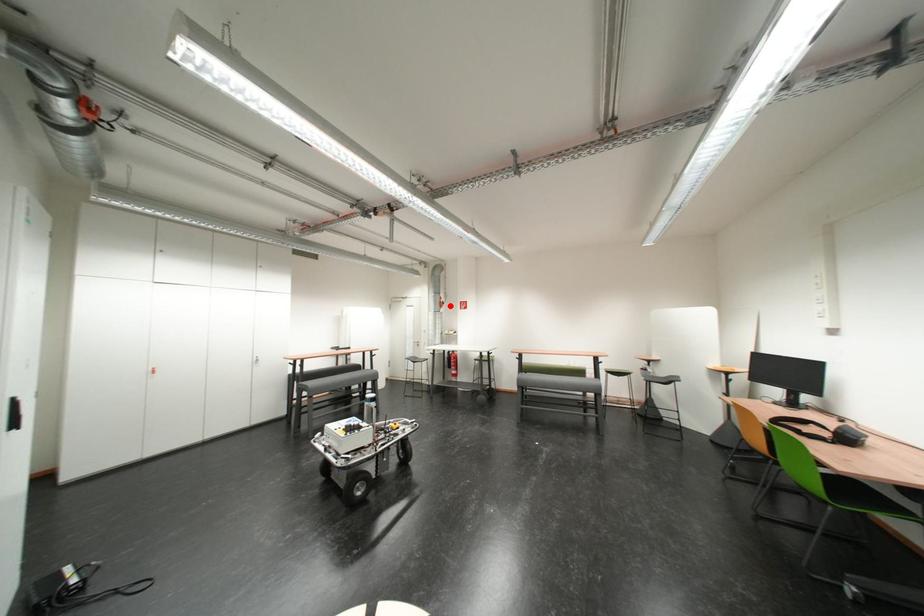
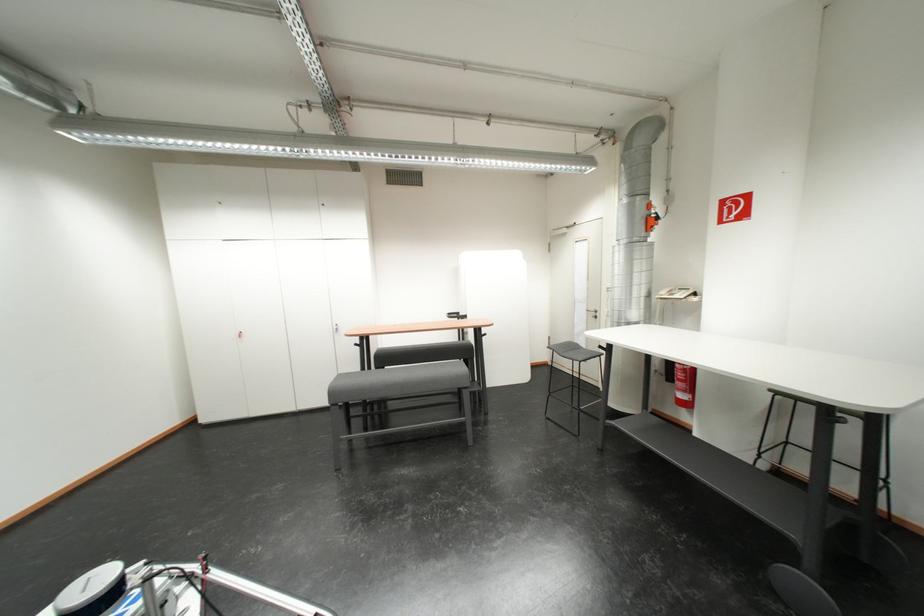
Find the pixel in the second image that matches the highlighted location in the first image.

(654, 224)